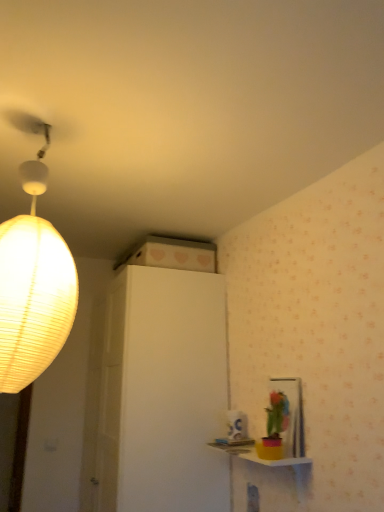
Question: Is matte paper lampshade at left to the left or to the right of yellow matte table at lower right in the image?

Choices:
 (A) right
 (B) left

Answer: (B)

Question: From the image's perspective, is matte paper lampshade at left positioned above or below yellow matte table at lower right?

Choices:
 (A) below
 (B) above

Answer: (B)

Question: Is point (13, 321) closer or farther from the camera than point (246, 461)?

Choices:
 (A) farther
 (B) closer

Answer: (B)

Question: Is yellow matte table at lower right taller or shorter than matte paper lampshade at left?

Choices:
 (A) tall
 (B) short

Answer: (B)

Question: Is point (223, 439) positioned closer to the camera than point (0, 304)?

Choices:
 (A) farther
 (B) closer

Answer: (A)

Question: Considering the positions of yellow matte table at lower right and matte paper lampshade at left in the image, is yellow matte table at lower right wider or thinner than matte paper lampshade at left?

Choices:
 (A) thin
 (B) wide

Answer: (A)

Question: From a real-world perspective, relative to matte paper lampshade at left, is yellow matte table at lower right vertically above or below?

Choices:
 (A) below
 (B) above

Answer: (A)